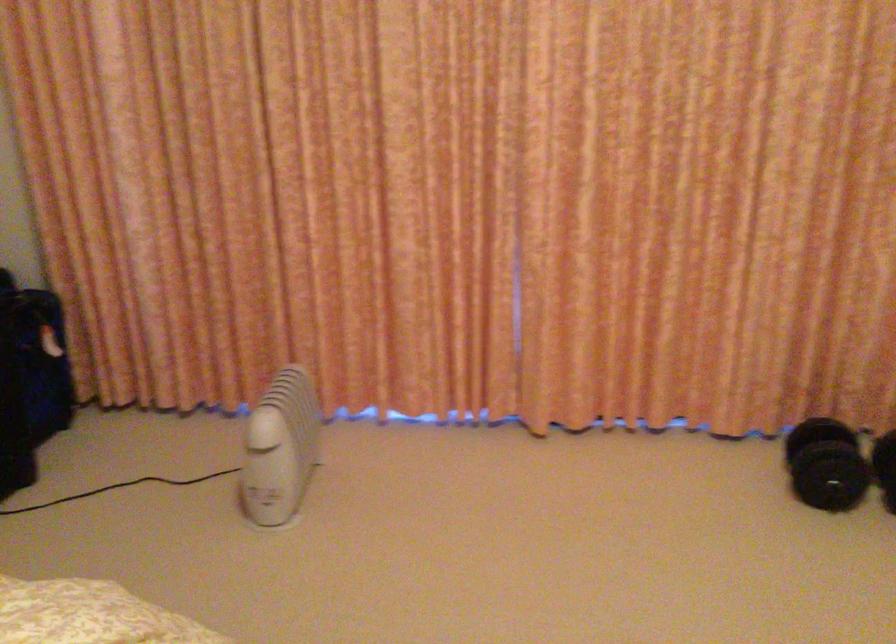
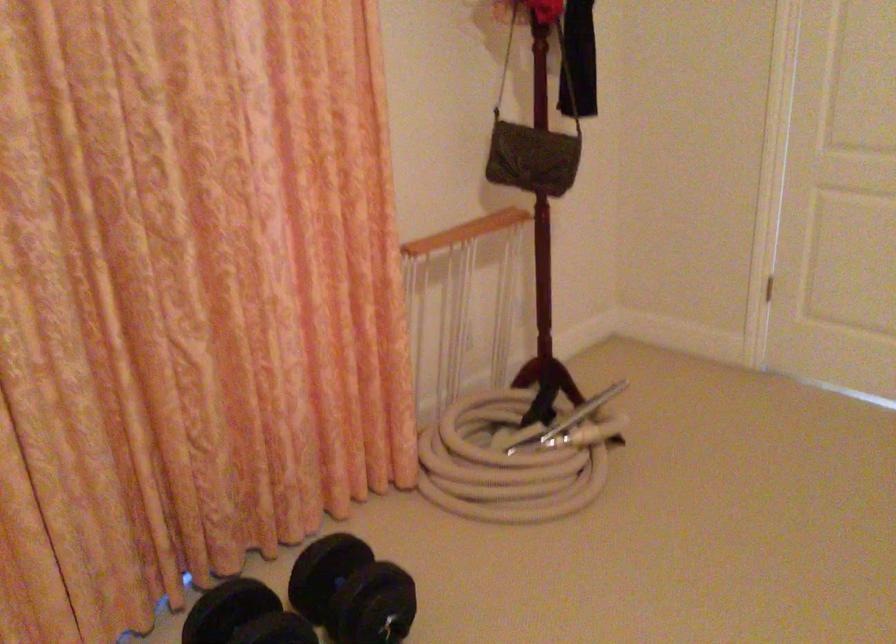
Question: How did the camera likely rotate?

Choices:
 (A) Left
 (B) Right
 (C) Up
 (D) Down

Answer: (B)